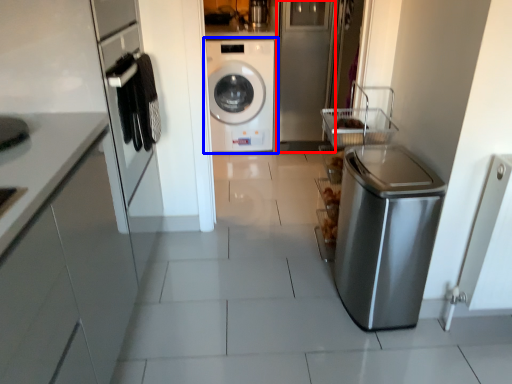
Question: Among these objects, which one is nearest to the camera, glass door (highlighted by a red box) or washing machine (highlighted by a blue box)?

Choices:
 (A) glass door
 (B) washing machine

Answer: (A)